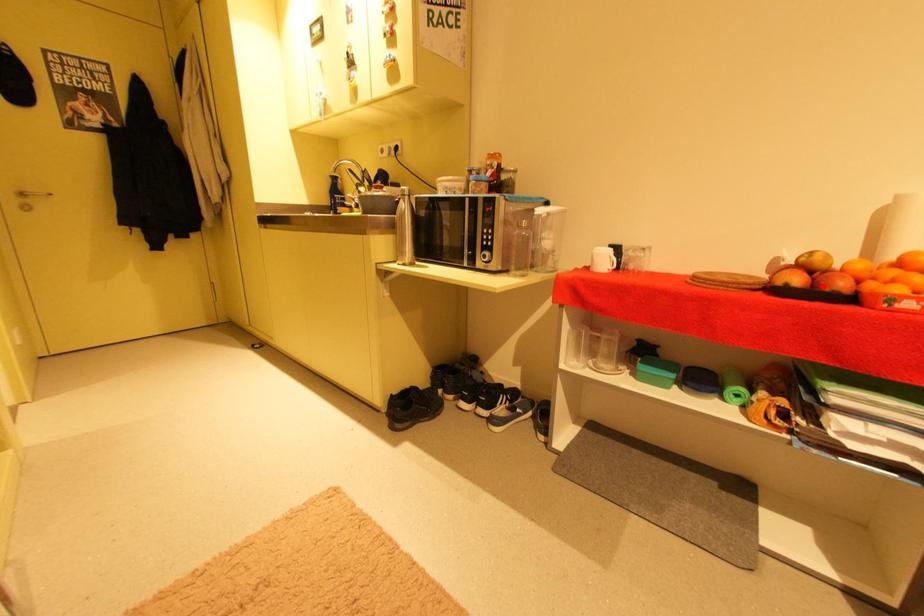
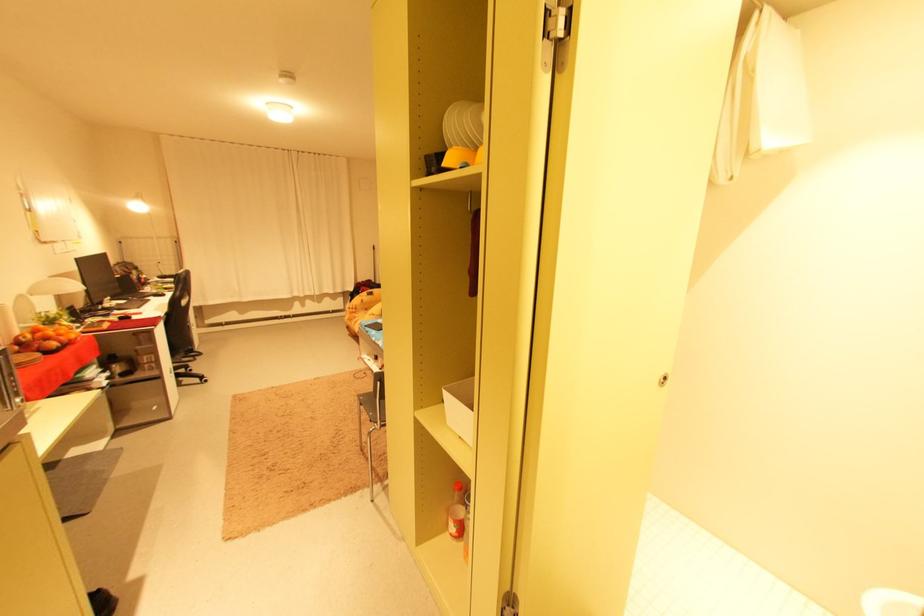
Question: I am providing you with two images of the same scene from different viewpoints. Image1 has a red point marked. In image2, the corresponding 3D location appears at what relative position? Reply with the corresponding letter.

Choices:
 (A) Closer
 (B) Farther

Answer: (B)